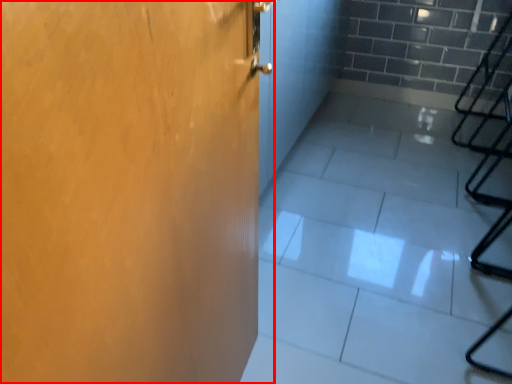
Question: Where is door (annotated by the red box) located in relation to concrete in the image?

Choices:
 (A) right
 (B) left

Answer: (B)